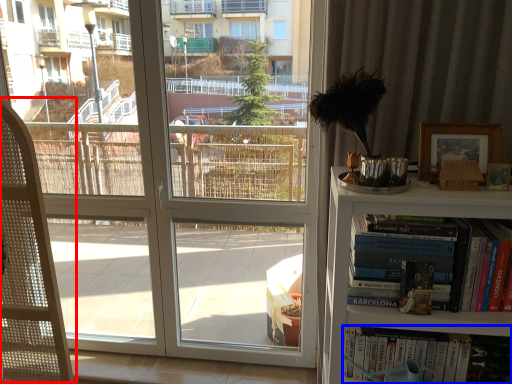
Question: Which of the following is the farthest to the observer, folding chair (highlighted by a red box) or book (highlighted by a blue box)?

Choices:
 (A) folding chair
 (B) book

Answer: (B)